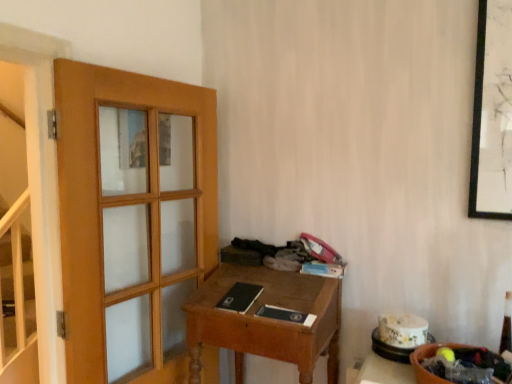
Question: Is matte blue book at center, placed as the first book when sorted from right to left, turned away from matte black book at center, positioned as the 2th book in left-to-right order?

Choices:
 (A) yes
 (B) no

Answer: (B)

Question: Does matte blue book at center, arranged as the third book when viewed from the left, contain matte black book at center, positioned as the 2th book in left-to-right order?

Choices:
 (A) yes
 (B) no

Answer: (B)

Question: Considering the relative sizes of matte blue book at center, placed as the first book when sorted from right to left, and matte black book at center, positioned as the 2th book in left-to-right order, in the image provided, is matte blue book at center, placed as the first book when sorted from right to left, shorter than matte black book at center, positioned as the 2th book in left-to-right order,?

Choices:
 (A) yes
 (B) no

Answer: (A)

Question: Considering the relative positions of matte blue book at center, arranged as the third book when viewed from the left, and matte black book at center, which ranks as the 2th book in right-to-left order, in the image provided, is matte blue book at center, arranged as the third book when viewed from the left, in front of matte black book at center, which ranks as the 2th book in right-to-left order,?

Choices:
 (A) no
 (B) yes

Answer: (A)

Question: Can you confirm if matte blue book at center, arranged as the third book when viewed from the left, is taller than matte black book at center, which ranks as the 2th book in right-to-left order?

Choices:
 (A) yes
 (B) no

Answer: (B)

Question: Considering the positions of matte black book at center, which ranks as the 2th book in right-to-left order, and black matte book at center, the 3th book when ordered from right to left, in the image, is matte black book at center, which ranks as the 2th book in right-to-left order, taller or shorter than black matte book at center, the 3th book when ordered from right to left,?

Choices:
 (A) short
 (B) tall

Answer: (B)

Question: Is matte black book at center, which ranks as the 2th book in right-to-left order, bigger or smaller than black matte book at center, the 3th book when ordered from right to left?

Choices:
 (A) big
 (B) small

Answer: (B)

Question: Based on their positions, is matte black book at center, which ranks as the 2th book in right-to-left order, located to the left or right of black matte book at center, the 3th book when ordered from right to left?

Choices:
 (A) right
 (B) left

Answer: (A)

Question: From a real-world perspective, relative to black matte book at center, which appears as the 1th book when viewed from the left, is matte black book at center, positioned as the 2th book in left-to-right order, vertically above or below?

Choices:
 (A) below
 (B) above

Answer: (A)

Question: From a real-world perspective, is matte blue book at center, arranged as the third book when viewed from the left, positioned above or below white glossy stairwell at left?

Choices:
 (A) below
 (B) above

Answer: (B)

Question: Do you think matte blue book at center, placed as the first book when sorted from right to left, is within white glossy stairwell at left, or outside of it?

Choices:
 (A) outside
 (B) inside

Answer: (A)

Question: Considering the positions of matte blue book at center, arranged as the third book when viewed from the left, and white glossy stairwell at left in the image, is matte blue book at center, arranged as the third book when viewed from the left, bigger or smaller than white glossy stairwell at left?

Choices:
 (A) small
 (B) big

Answer: (A)

Question: Is matte blue book at center, placed as the first book when sorted from right to left, wider or thinner than white glossy stairwell at left?

Choices:
 (A) wide
 (B) thin

Answer: (A)

Question: In terms of height, does matte black book at center, which ranks as the 2th book in right-to-left order, look taller or shorter compared to wooden desk at center?

Choices:
 (A) tall
 (B) short

Answer: (B)

Question: From a real-world perspective, relative to wooden desk at center, is matte black book at center, which ranks as the 2th book in right-to-left order, vertically above or below?

Choices:
 (A) above
 (B) below

Answer: (A)